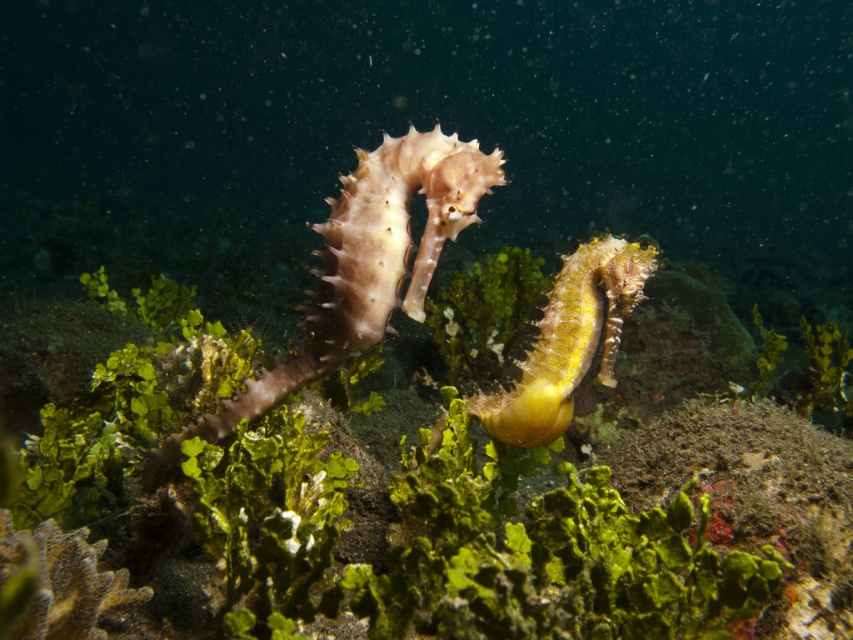
Question: Is smooth pink seahorse at center bigger than yellow matte seahorse at center?

Choices:
 (A) yes
 (B) no

Answer: (A)

Question: Among these objects, which one is farthest from the camera?

Choices:
 (A) green mossy coral at center
 (B) smooth pink seahorse at center
 (C) yellow matte seahorse at center

Answer: (C)

Question: Is the position of green mossy coral at center more distant than that of smooth pink seahorse at center?

Choices:
 (A) no
 (B) yes

Answer: (A)

Question: Does green mossy coral at center appear over yellow matte seahorse at center?

Choices:
 (A) yes
 (B) no

Answer: (B)

Question: Which of the following is the closest to the observer?

Choices:
 (A) green mossy coral at center
 (B) smooth pink seahorse at center

Answer: (A)

Question: Which of the following is the closest to the observer?

Choices:
 (A) green mossy coral at center
 (B) yellow matte seahorse at center
 (C) smooth pink seahorse at center

Answer: (A)